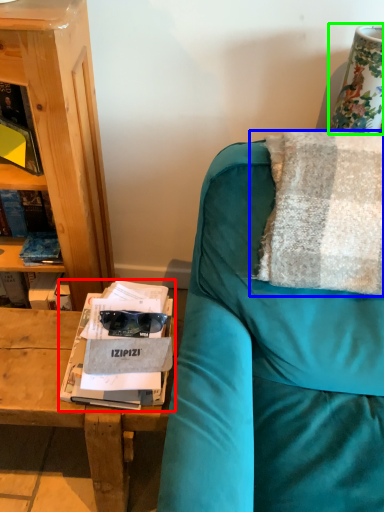
Question: Estimate the real-world distances between objects in this image. Which object is closer to magazine (highlighted by a red box), pillow (highlighted by a blue box) or table lamp (highlighted by a green box)?

Choices:
 (A) pillow
 (B) table lamp

Answer: (A)